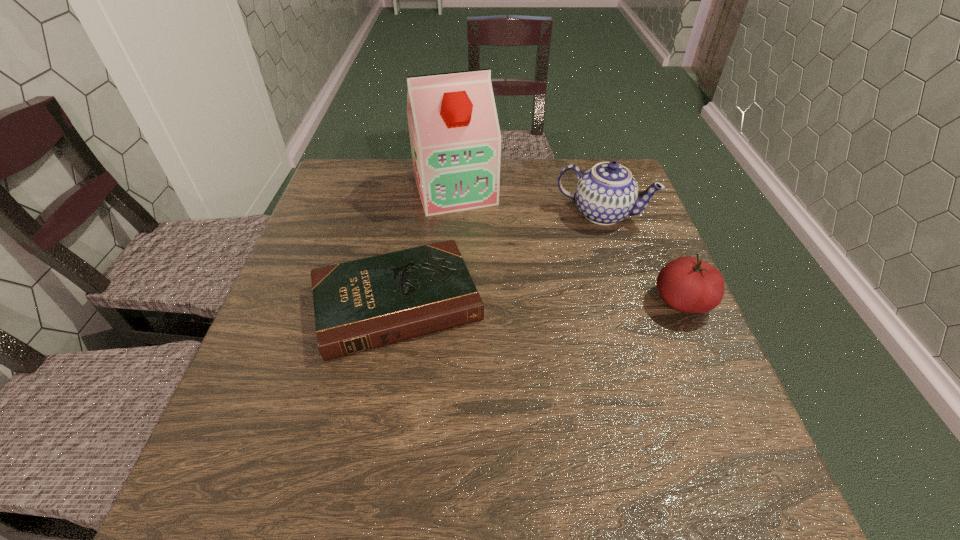
Find the location of a particular element. Image resolution: width=960 pixels, height=540 pixels. vacant space on the desktop that is between the shortest object and the tomato and is positioned at the spout of the chinaware is located at coordinates (566, 302).

This screenshot has height=540, width=960. I want to click on vacant space on the desktop that is between the shortest object and the tomato and is positioned with the cap open on the soya milk, so click(499, 302).